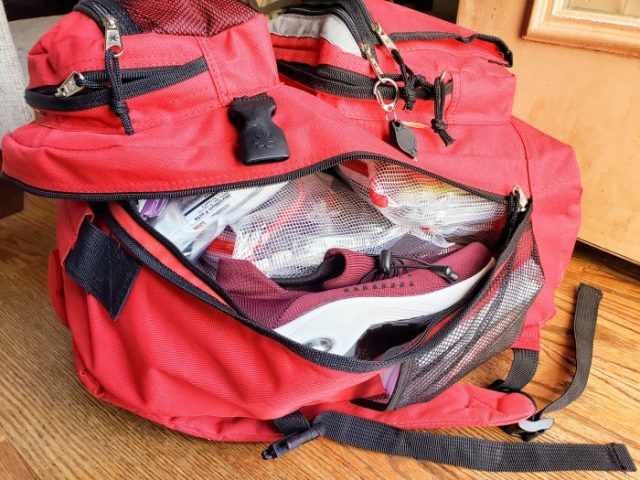
The height and width of the screenshot is (480, 640). Identify the location of wall. (610, 114).